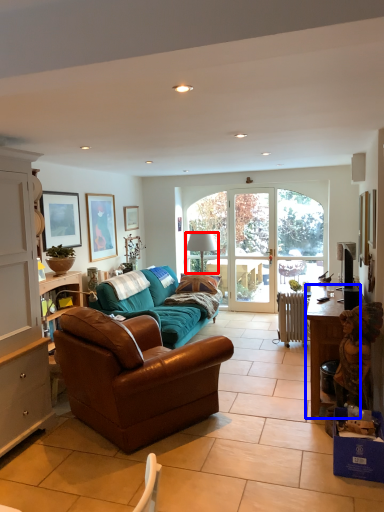
Question: Which of the following is the farthest to the observer, lamp (highlighted by a red box) or desk (highlighted by a blue box)?

Choices:
 (A) lamp
 (B) desk

Answer: (A)